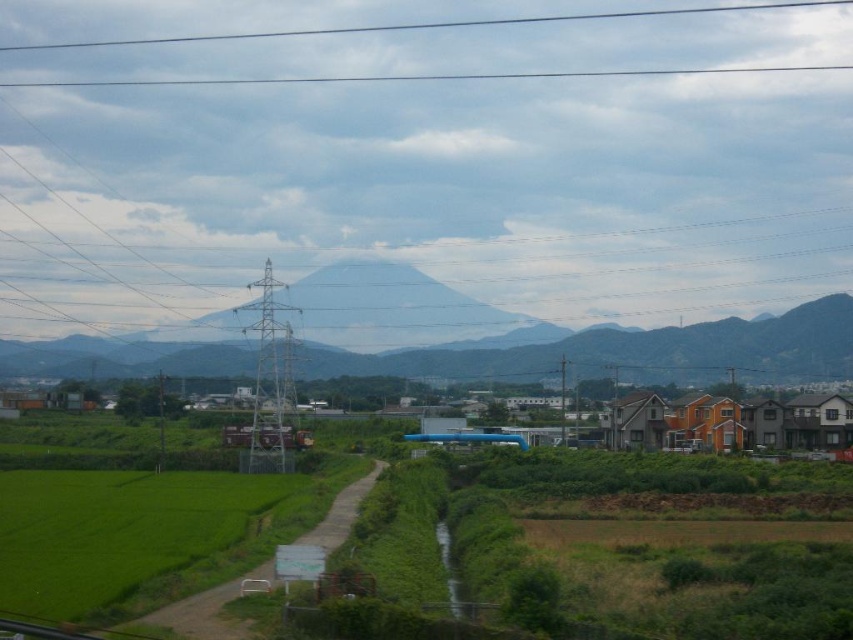
Question: Can you confirm if gray rocky mountain at center is wider than transparent glass power line at upper center?

Choices:
 (A) yes
 (B) no

Answer: (B)

Question: Can you confirm if green grass field at lower left is wider than gray rocky mountain at center?

Choices:
 (A) yes
 (B) no

Answer: (B)

Question: Which object is positioned closest to the green grass field at lower left?

Choices:
 (A) gray rocky mountain at center
 (B) transparent glass power line at upper center

Answer: (A)

Question: Which of the following is the closest to the observer?

Choices:
 (A) [x=479, y=371]
 (B) [x=164, y=580]
 (C) [x=798, y=3]

Answer: (B)

Question: Which point is closer to the camera?

Choices:
 (A) (49, 371)
 (B) (688, 8)

Answer: (A)

Question: Can you confirm if gray rocky mountain at center is positioned to the right of transparent glass power line at upper center?

Choices:
 (A) no
 (B) yes

Answer: (A)